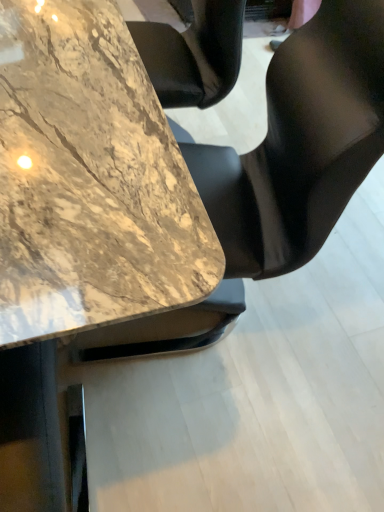
Question: Does marble table at center come behind black leather chair at center?

Choices:
 (A) no
 (B) yes

Answer: (A)

Question: Is marble table at center oriented away from black leather chair at center?

Choices:
 (A) yes
 (B) no

Answer: (B)

Question: From the image's perspective, is marble table at center over black leather chair at center?

Choices:
 (A) yes
 (B) no

Answer: (A)

Question: Could you tell me if marble table at center is turned towards black leather chair at center?

Choices:
 (A) no
 (B) yes

Answer: (B)

Question: Is marble table at center not within black leather chair at center?

Choices:
 (A) no
 (B) yes

Answer: (B)

Question: Is marble table at center positioned far away from black leather chair at center?

Choices:
 (A) yes
 (B) no

Answer: (B)

Question: Is black leather chair at center shorter than marble table at center?

Choices:
 (A) yes
 (B) no

Answer: (B)

Question: Is black leather chair at center facing away from marble table at center?

Choices:
 (A) no
 (B) yes

Answer: (A)

Question: Is black leather chair at center far from marble table at center?

Choices:
 (A) no
 (B) yes

Answer: (A)

Question: Is black leather chair at center at the right side of marble table at center?

Choices:
 (A) no
 (B) yes

Answer: (B)

Question: From a real-world perspective, is black leather chair at center under marble table at center?

Choices:
 (A) no
 (B) yes

Answer: (A)

Question: From the image's perspective, would you say black leather chair at center is positioned over marble table at center?

Choices:
 (A) no
 (B) yes

Answer: (A)

Question: From the image's perspective, is marble table at center located above or below black leather chair at center?

Choices:
 (A) below
 (B) above

Answer: (B)